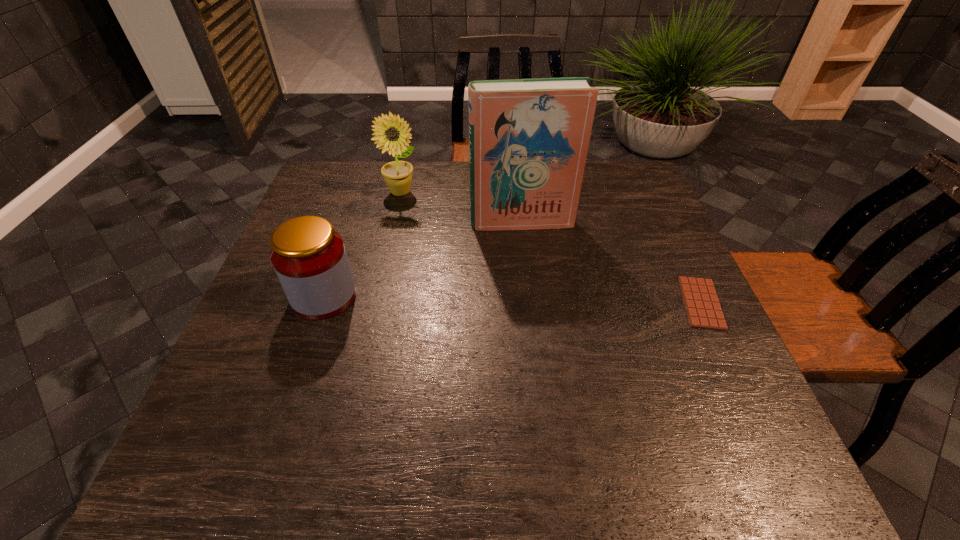
This screenshot has height=540, width=960. Identify the location of vacant space in between the hardback book and the shortest object. (612, 262).

I want to click on free space between the shortest object and the jar, so click(513, 300).

Identify the location of vacant space that is in between the farthest object and the second farthest object. The image size is (960, 540). click(462, 207).

Identify which object is located as the third nearest to the shortest object. Please provide its 2D coordinates. Your answer should be formatted as a tuple, i.e. [(x, y)], where the tuple contains the x and y coordinates of a point satisfying the conditions above.

[(309, 257)]

Point out which object is positioned as the third nearest to the third shortest object. Please provide its 2D coordinates. Your answer should be formatted as a tuple, i.e. [(x, y)], where the tuple contains the x and y coordinates of a point satisfying the conditions above.

[(703, 309)]

Locate an element on the screen. free location that satisfies the following two spatial constraints: 1. on the front side of the candy bar; 2. on the right side of the second farthest object is located at coordinates (531, 303).

I want to click on vacant space that satisfies the following two spatial constraints: 1. on the front side of the third shortest object; 2. on the left side of the tallest object, so click(x=395, y=222).

I want to click on vacant space that satisfies the following two spatial constraints: 1. on the front side of the shortest object; 2. on the right side of the second object from right to left, so click(531, 303).

The width and height of the screenshot is (960, 540). I want to click on vacant region that satisfies the following two spatial constraints: 1. on the back side of the farthest object; 2. on the right side of the second shortest object, so click(359, 192).

Where is `vacant region that satisfies the following two spatial constraints: 1. on the front side of the third nearest object; 2. on the right side of the sunflower`? The width and height of the screenshot is (960, 540). vacant region that satisfies the following two spatial constraints: 1. on the front side of the third nearest object; 2. on the right side of the sunflower is located at coordinates (395, 222).